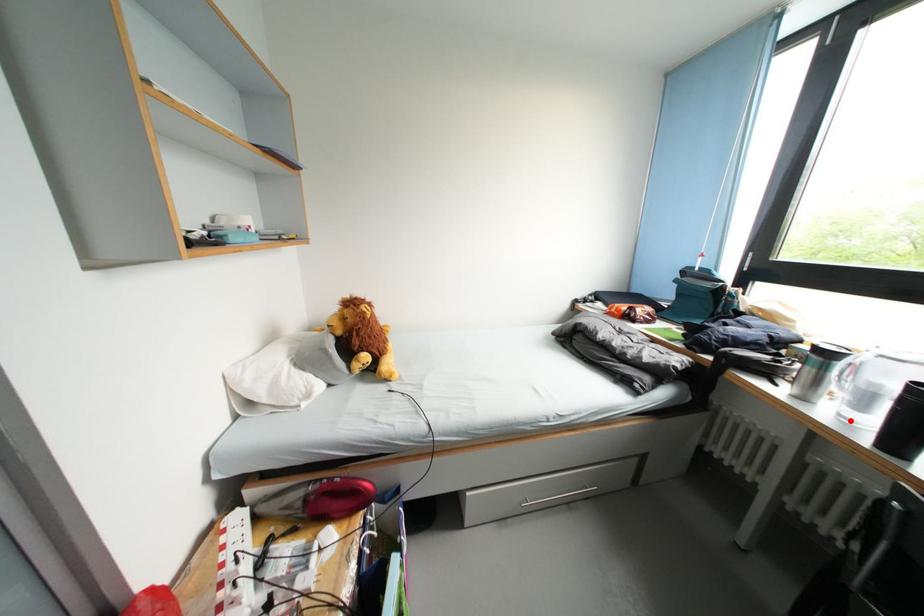
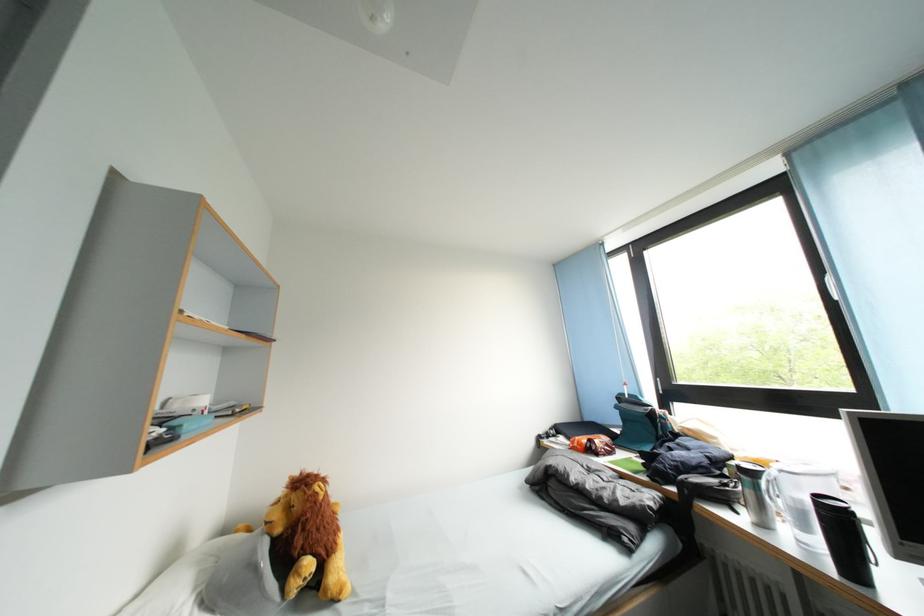
Question: A red point is marked in image1. In image2, is the corresponding 3D point closer to the camera or farther? Reply with the corresponding letter.

Choices:
 (A) The corresponding 3D point is closer.
 (B) The corresponding 3D point is farther.

Answer: (A)